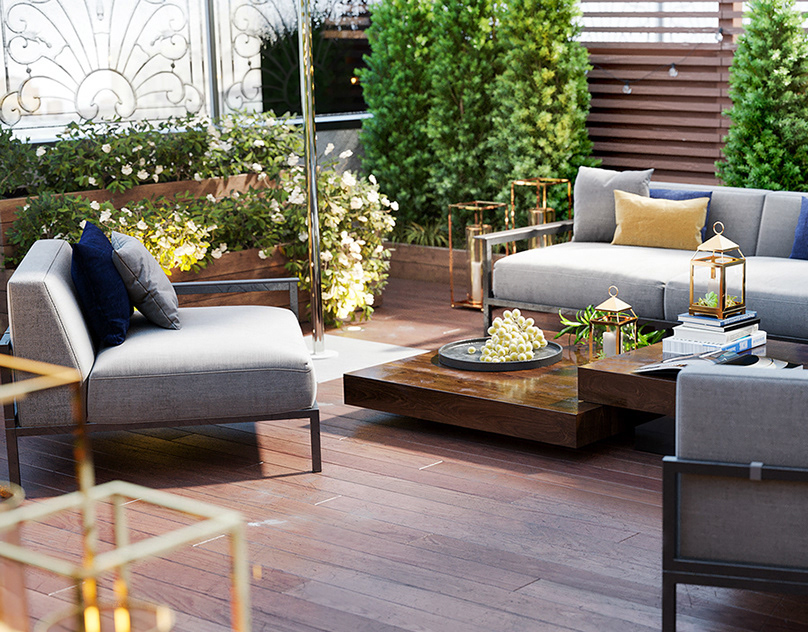
This screenshot has height=632, width=808. Find the location of `holders candle`. holders candle is located at coordinates (727, 280), (617, 322).